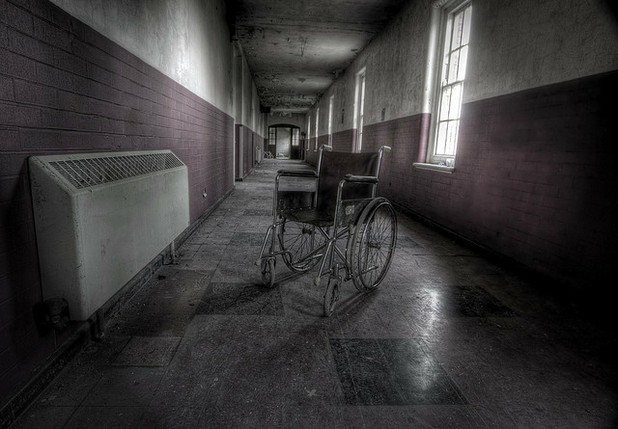
In order to click on wheelchair arm rests in this screenshot , I will do `click(362, 177)`, `click(293, 171)`.